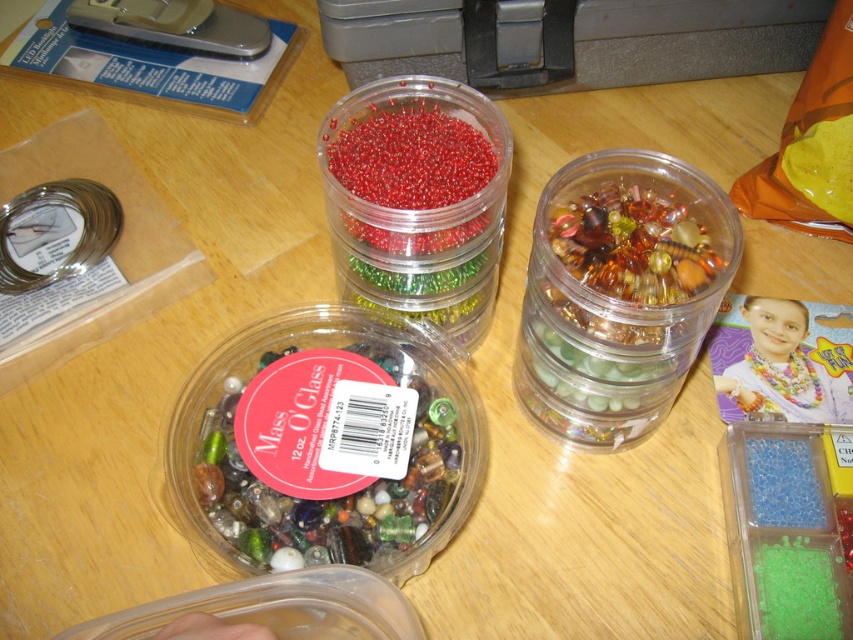
You are organizing beads for a craft project and need to place the translucent plastic beads at upper right and blue translucent beads at lower right into separate boxes. Which bead group should you reach for first to ensure you can easily access both without moving the other?

You should reach for the translucent plastic beads at upper right first because it is closer to the viewer than the blue translucent beads at lower right, making it easier to access without disturbing the other.

You are organizing a craft fair and need to place a 6 inch ruler between the translucent plastic beads at upper right and the blue translucent beads at lower right. Can the ruler fit without overlapping either bead group?

The distance between the translucent plastic beads at upper right and blue translucent beads at lower right is 7.37 inches, so a 6 inch ruler can fit between them without overlapping either bead group.